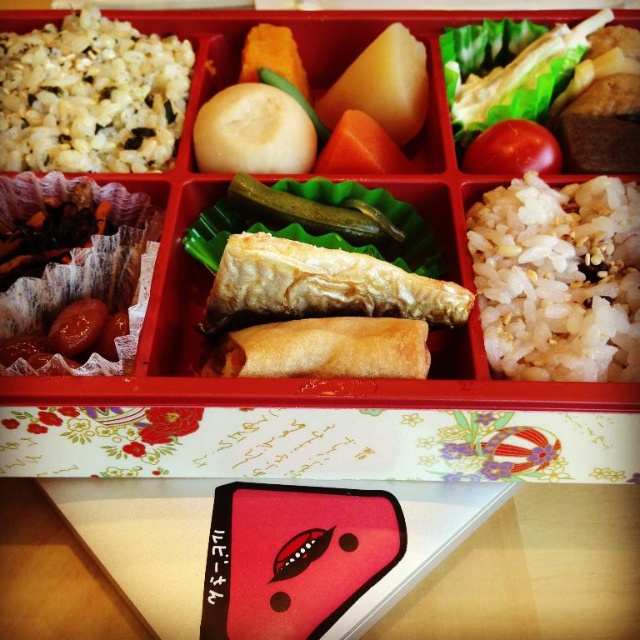
Question: Which point is closer to the camera?

Choices:
 (A) red smooth tomato at center
 (B) green pickled vegetable at center
 (C) matte red lunch box at center

Answer: (C)

Question: Is green pickled vegetable at center closer to the viewer compared to red matte tomato at upper right?

Choices:
 (A) no
 (B) yes

Answer: (B)

Question: Which object is closer to the camera taking this photo?

Choices:
 (A) red smooth tomato at center
 (B) green leafy vegetable at upper right
 (C) red matte tomato at upper right
 (D) green pickled vegetable at center

Answer: (D)

Question: Does green pickled vegetable at center have a larger size compared to red smooth tomato at center?

Choices:
 (A) yes
 (B) no

Answer: (B)

Question: Which point is farther from the camera taking this photo?

Choices:
 (A) (376, 140)
 (B) (541, 138)
 (C) (625, 202)

Answer: (A)

Question: Does matte red lunch box at center have a smaller size compared to green leafy vegetable at upper right?

Choices:
 (A) yes
 (B) no

Answer: (B)